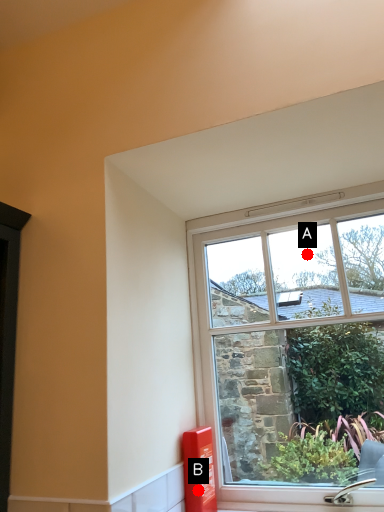
Question: Two points are circled on the image, labeled by A and B beside each circle. Among these points, which one is farthest from the camera?

Choices:
 (A) A is further
 (B) B is further

Answer: (A)